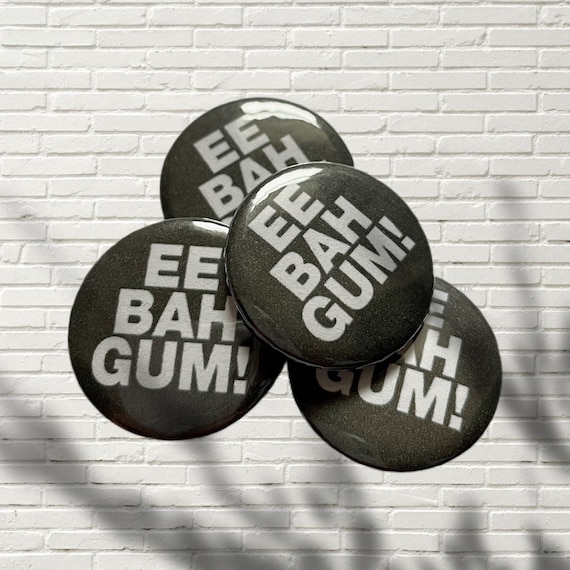
In order to click on brickwall in this screenshot , I will do `click(215, 58)`.